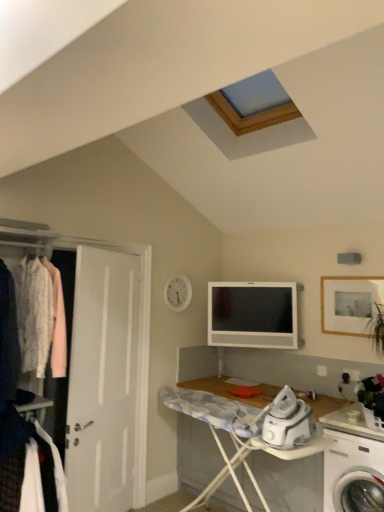
Question: Is satin silver television at center thinner than white matte door at left?

Choices:
 (A) yes
 (B) no

Answer: (A)

Question: Is satin silver television at center taller than white matte door at left?

Choices:
 (A) no
 (B) yes

Answer: (A)

Question: Can you confirm if satin silver television at center is wider than white matte door at left?

Choices:
 (A) no
 (B) yes

Answer: (A)

Question: From the image's perspective, is satin silver television at center below white matte door at left?

Choices:
 (A) no
 (B) yes

Answer: (A)

Question: Is satin silver television at center outside white matte door at left?

Choices:
 (A) no
 (B) yes

Answer: (B)

Question: Would you say satin silver television at center is a long distance from white matte door at left?

Choices:
 (A) yes
 (B) no

Answer: (A)

Question: Is white fabric at left facing towards satin silver television at center?

Choices:
 (A) no
 (B) yes

Answer: (A)

Question: Is satin silver television at center located within white fabric at left?

Choices:
 (A) no
 (B) yes

Answer: (A)

Question: Considering the relative sizes of white fabric at left and satin silver television at center in the image provided, is white fabric at left smaller than satin silver television at center?

Choices:
 (A) yes
 (B) no

Answer: (B)

Question: Considering the relative sizes of white fabric at left and satin silver television at center in the image provided, is white fabric at left taller than satin silver television at center?

Choices:
 (A) yes
 (B) no

Answer: (A)

Question: Is satin silver television at center at the back of white fabric at left?

Choices:
 (A) no
 (B) yes

Answer: (A)

Question: From the image's perspective, is white fabric at left located beneath satin silver television at center?

Choices:
 (A) no
 (B) yes

Answer: (B)

Question: Is white plastic washing machine at lower right in front of satin silver television at center?

Choices:
 (A) no
 (B) yes

Answer: (B)